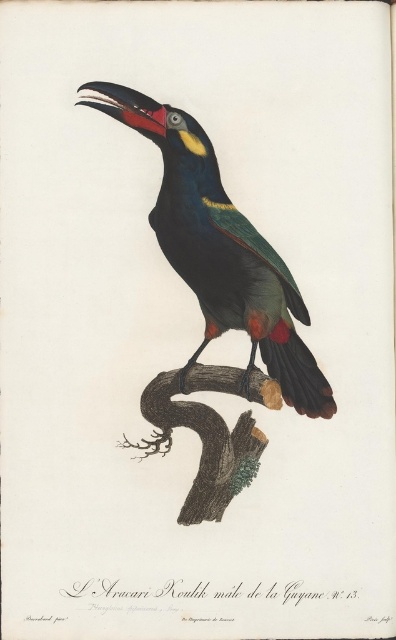
You are standing 5 feet away from the toucan in the image. If you move forward 0.5 feet, will you be closer than 4.49 feet to the point at coordinates point (257, 273)?

The distance of point (257, 273) from viewer is 4.49 feet. Moving forward 0.5 feet from your current position 5 feet away would bring you to 4.5 feet away, which is just slightly beyond the 4.49 feet distance. Therefore, you would not be closer than 4.49 feet to the point at coordinates point (257, 273).

You are an ornithologist observing a toucan in a rainforest. You notice a point at coordinates (220, 250). What does this point indicate?

The point at coordinates (220, 250) indicates the location of the shiny black toucan at center.

From the picture: Where is the shiny black toucan at center located in the image?

The shiny black toucan at center is located at point (220, 250).